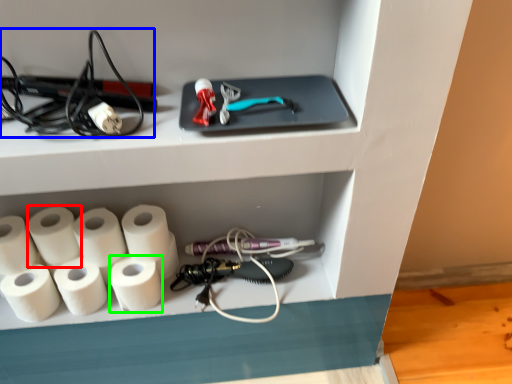
Question: Which is farther away from paper towel (highlighted by a red box)? equipment (highlighted by a blue box) or paper towel (highlighted by a green box)?

Choices:
 (A) equipment
 (B) paper towel

Answer: (A)